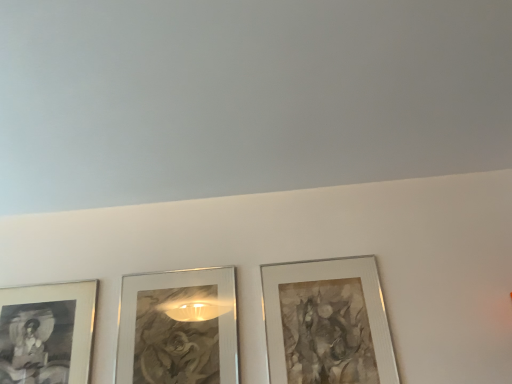
Question: Is matte black picture frame at lower left, placed as the 1th picture frame when sorted from left to right, outside metallic silver picture frame at center, marked as the second picture frame in a left-to-right arrangement?

Choices:
 (A) no
 (B) yes

Answer: (B)

Question: Is metallic silver picture frame at center, marked as the second picture frame in a left-to-right arrangement, at the back of matte black picture frame at lower left, the 3th picture frame from the right?

Choices:
 (A) yes
 (B) no

Answer: (B)

Question: Is matte black picture frame at lower left, placed as the 1th picture frame when sorted from left to right, further to camera compared to metallic silver picture frame at center, marked as the second picture frame in a left-to-right arrangement?

Choices:
 (A) yes
 (B) no

Answer: (A)

Question: Does matte black picture frame at lower left, placed as the 1th picture frame when sorted from left to right, have a lesser width compared to metallic silver picture frame at center, which is the second picture frame in right-to-left order?

Choices:
 (A) no
 (B) yes

Answer: (A)

Question: From a real-world perspective, is matte black picture frame at lower left, placed as the 1th picture frame when sorted from left to right, located beneath metallic silver picture frame at center, marked as the second picture frame in a left-to-right arrangement?

Choices:
 (A) yes
 (B) no

Answer: (B)

Question: From the image's perspective, does matte black picture frame at lower left, placed as the 1th picture frame when sorted from left to right, appear higher than metallic silver picture frame at center, marked as the second picture frame in a left-to-right arrangement?

Choices:
 (A) yes
 (B) no

Answer: (B)

Question: Considering the relative positions of metallic silver picture frame at center, marked as the second picture frame in a left-to-right arrangement, and matte black picture frame at lower left, the 3th picture frame from the right, in the image provided, is metallic silver picture frame at center, marked as the second picture frame in a left-to-right arrangement, in front of matte black picture frame at lower left, the 3th picture frame from the right,?

Choices:
 (A) no
 (B) yes

Answer: (B)

Question: Is matte black picture frame at lower left, the 3th picture frame from the right, surrounded by metallic silver picture frame at center, marked as the second picture frame in a left-to-right arrangement?

Choices:
 (A) yes
 (B) no

Answer: (B)

Question: Does metallic silver picture frame at center, marked as the second picture frame in a left-to-right arrangement, have a greater height compared to matte black picture frame at lower left, placed as the 1th picture frame when sorted from left to right?

Choices:
 (A) yes
 (B) no

Answer: (A)

Question: Is metallic silver picture frame at center, which is the second picture frame in right-to-left order, looking in the opposite direction of matte black picture frame at lower left, the 3th picture frame from the right?

Choices:
 (A) yes
 (B) no

Answer: (B)

Question: Is metallic silver picture frame at center, marked as the second picture frame in a left-to-right arrangement, in contact with matte black picture frame at lower left, placed as the 1th picture frame when sorted from left to right?

Choices:
 (A) no
 (B) yes

Answer: (A)

Question: Considering the relative positions of metallic silver picture frame at center, which is the second picture frame in right-to-left order, and matte black picture frame at lower left, placed as the 1th picture frame when sorted from left to right, in the image provided, is metallic silver picture frame at center, which is the second picture frame in right-to-left order, to the left of matte black picture frame at lower left, placed as the 1th picture frame when sorted from left to right, from the viewer's perspective?

Choices:
 (A) yes
 (B) no

Answer: (B)

Question: Is silver metallic picture frame at center right, placed as the 1th picture frame when sorted from right to left, touching metallic silver picture frame at center, marked as the second picture frame in a left-to-right arrangement?

Choices:
 (A) yes
 (B) no

Answer: (B)